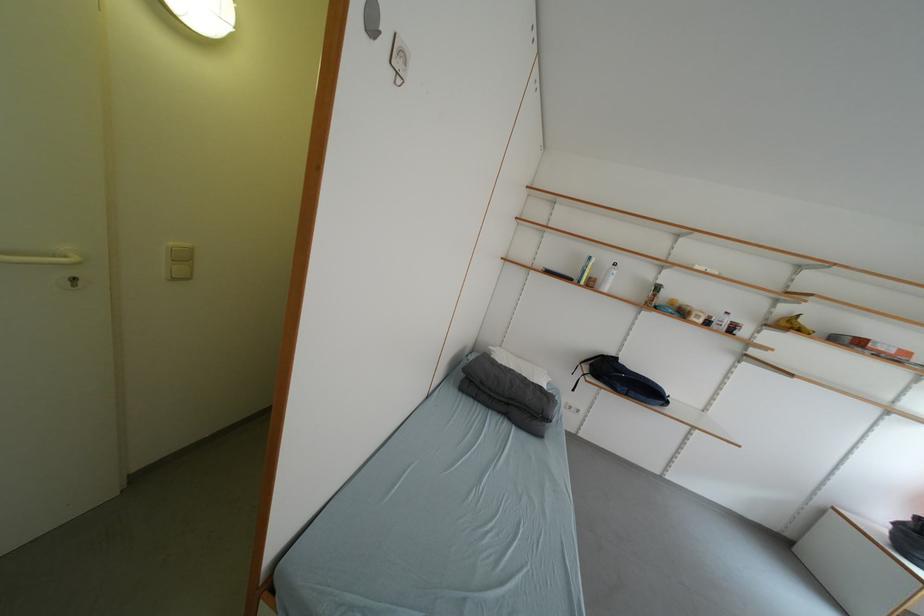
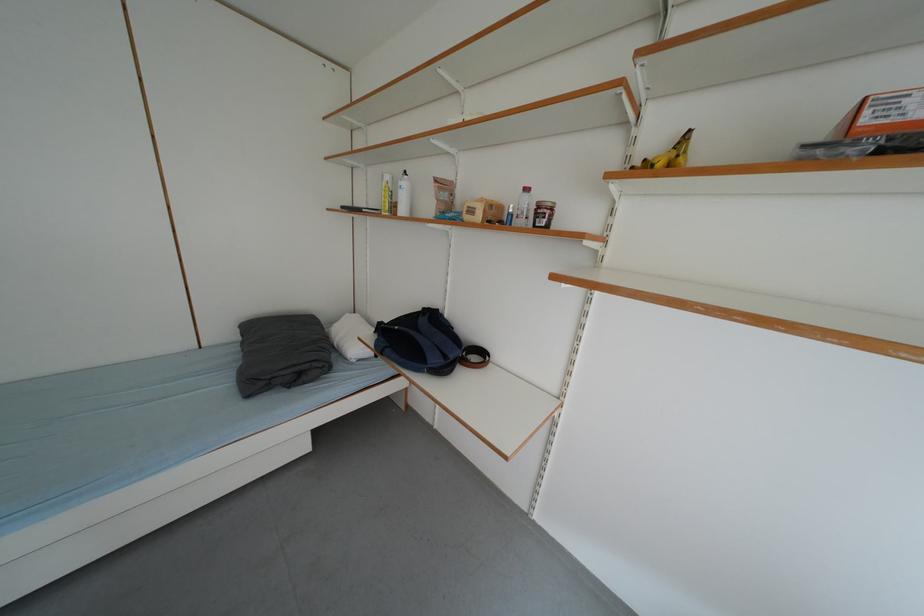
Where in the second image is the point corresponding to pixel 709 323 from the first image?

(487, 220)